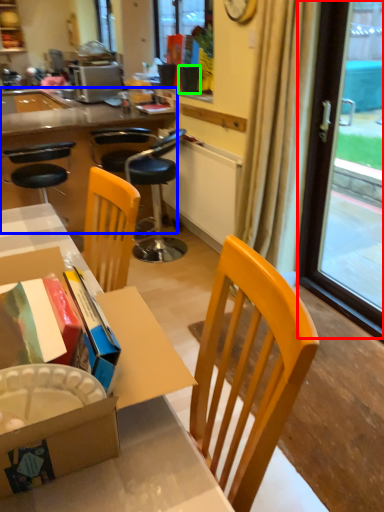
Question: Which is farther away from window screen (highlighted by a red box)? desk (highlighted by a blue box) or flowerpot (highlighted by a green box)?

Choices:
 (A) desk
 (B) flowerpot

Answer: (A)